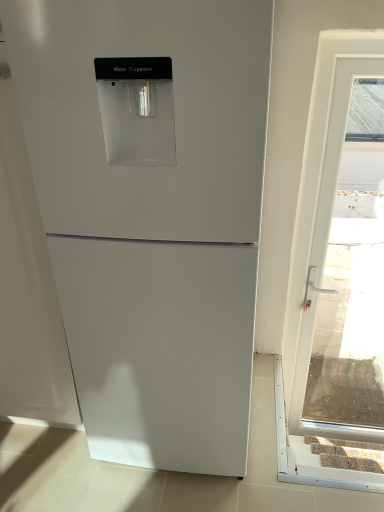
Identify the location of transparent glass door at right. (313, 229).

Describe the element at coordinates (313, 229) in the screenshot. The image size is (384, 512). I see `transparent glass door at right` at that location.

In order to click on transparent glass door at right in this screenshot , I will do `click(313, 229)`.